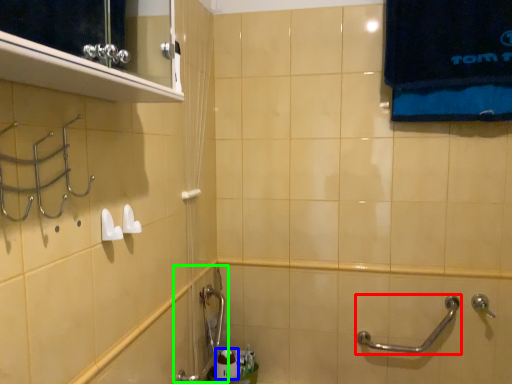
Question: Which object is positioned closest to door handle (highlighted by a red box)? Select from toiletry (highlighted by a blue box) and plumbing fixture (highlighted by a green box).

Choices:
 (A) toiletry
 (B) plumbing fixture

Answer: (A)